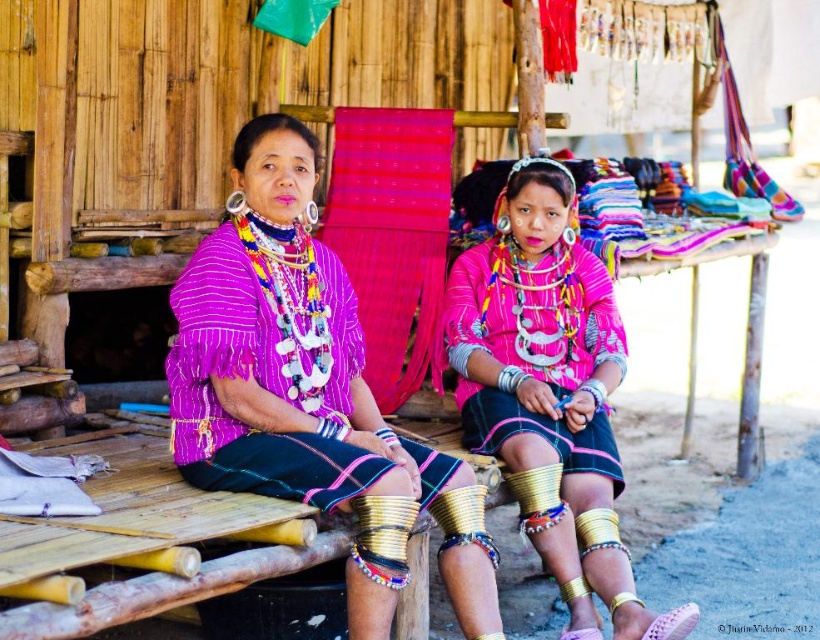
Question: Can you confirm if matte purple blouse at center is thinner than pink matte fabric at center?

Choices:
 (A) yes
 (B) no

Answer: (B)

Question: Which object is closer to the camera taking this photo?

Choices:
 (A) pink matte fabric at center
 (B) matte purple blouse at center

Answer: (B)

Question: Is matte purple blouse at center further to the viewer compared to pink matte fabric at center?

Choices:
 (A) yes
 (B) no

Answer: (B)

Question: Among these objects, which one is nearest to the camera?

Choices:
 (A) matte purple blouse at center
 (B) pink matte fabric at center

Answer: (A)

Question: In this image, where is matte purple blouse at center located relative to pink matte fabric at center?

Choices:
 (A) right
 (B) left

Answer: (B)